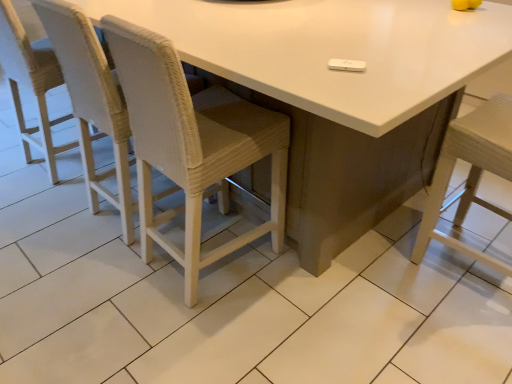
Question: Is woven fabric chair at left, the 3th chair viewed from the right, wider or thinner than woven white chair at left, which is the 2th chair from left to right?

Choices:
 (A) thin
 (B) wide

Answer: (A)

Question: Based on their sizes in the image, would you say woven fabric chair at left, the 3th chair viewed from the right, is bigger or smaller than woven white chair at left, which is the 2th chair from left to right?

Choices:
 (A) small
 (B) big

Answer: (A)

Question: Estimate the real-world distances between objects in this image. Which object is farther from the woven white chair at center, the third chair in the left-to-right sequence?

Choices:
 (A) woven white chair at left, which is the 2th chair from left to right
 (B) woven fabric chair at left, the 3th chair viewed from the right
 (C) white glossy table at center

Answer: (B)

Question: Which of these objects is positioned farthest from the white glossy table at center?

Choices:
 (A) woven fabric chair at left, the first chair in the left-to-right sequence
 (B) woven white chair at left, which ranks as the second chair in right-to-left order
 (C) woven white chair at center, the third chair in the left-to-right sequence

Answer: (A)